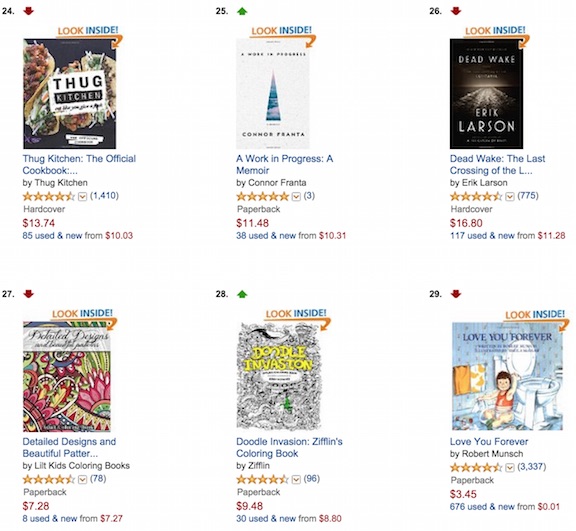
Where is `titles (on book)`? This screenshot has height=531, width=576. titles (on book) is located at coordinates (51, 331), (473, 338), (469, 61), (251, 52), (62, 83).